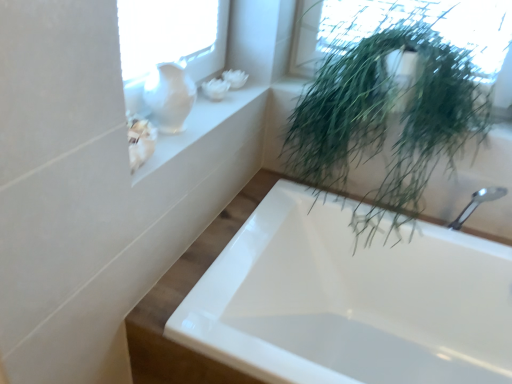
Question: Could you tell me if green leafy plant at upper right is facing white glass vase at upper left?

Choices:
 (A) yes
 (B) no

Answer: (B)

Question: Is green leafy plant at upper right not inside white glass vase at upper left?

Choices:
 (A) yes
 (B) no

Answer: (A)

Question: Can you confirm if green leafy plant at upper right is smaller than white glass vase at upper left?

Choices:
 (A) yes
 (B) no

Answer: (B)

Question: From the image's perspective, would you say green leafy plant at upper right is shown under white glass vase at upper left?

Choices:
 (A) yes
 (B) no

Answer: (A)

Question: Is green leafy plant at upper right behind white glass vase at upper left?

Choices:
 (A) no
 (B) yes

Answer: (A)

Question: Is green leafy plant at upper right at the left side of white glass vase at upper left?

Choices:
 (A) yes
 (B) no

Answer: (B)

Question: From a real-world perspective, is white glossy bathtub at lower right physically above white glass vase at upper left?

Choices:
 (A) no
 (B) yes

Answer: (A)

Question: Does white glossy bathtub at lower right contain white glass vase at upper left?

Choices:
 (A) yes
 (B) no

Answer: (B)

Question: Are white glossy bathtub at lower right and white glass vase at upper left beside each other?

Choices:
 (A) yes
 (B) no

Answer: (B)

Question: Is white glossy bathtub at lower right not close to white glass vase at upper left?

Choices:
 (A) yes
 (B) no

Answer: (B)

Question: From the image's perspective, is white glossy bathtub at lower right over white glass vase at upper left?

Choices:
 (A) yes
 (B) no

Answer: (B)

Question: Does white glossy bathtub at lower right appear on the right side of white glass vase at upper left?

Choices:
 (A) yes
 (B) no

Answer: (A)

Question: Does white glass vase at upper left lie in front of green leafy plant at upper right?

Choices:
 (A) yes
 (B) no

Answer: (B)